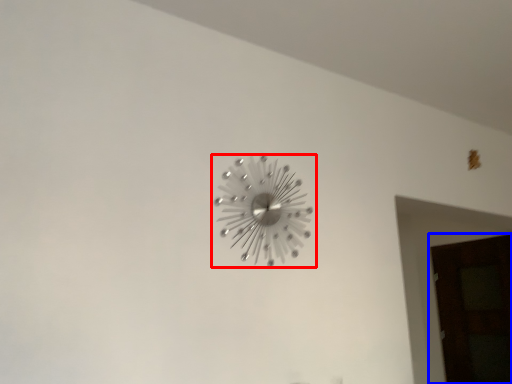
Question: Which of the following is the closest to the observer, wall clock (highlighted by a red box) or door (highlighted by a blue box)?

Choices:
 (A) wall clock
 (B) door

Answer: (A)